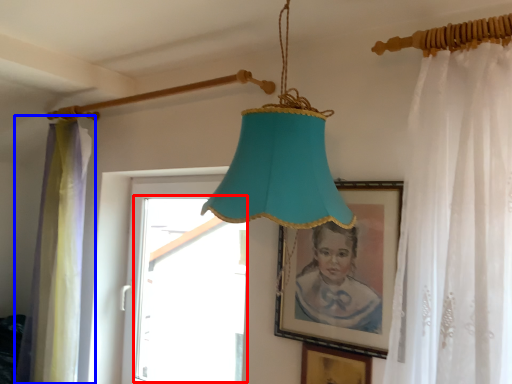
Question: Which of the following is the closest to the observer, window (highlighted by a red box) or curtain (highlighted by a blue box)?

Choices:
 (A) window
 (B) curtain

Answer: (A)